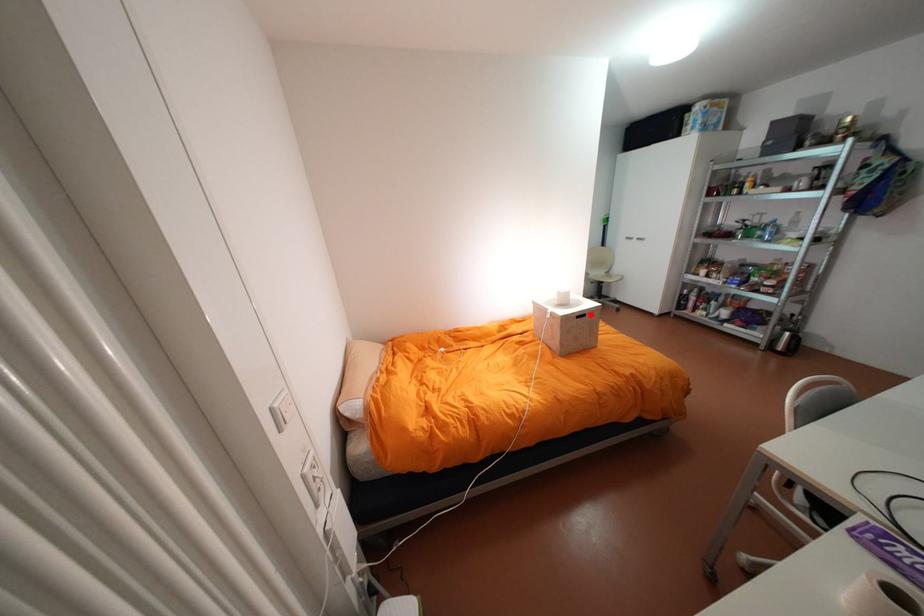
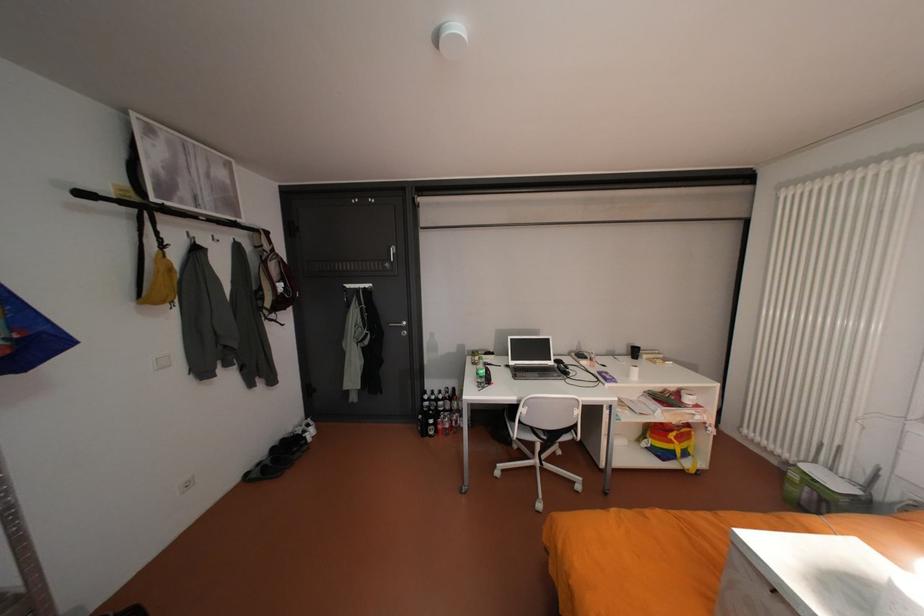
Question: I am providing you with two images of the same scene from different viewpoints. A red point is marked on the first image. Is the red point's position out of view in image 2?

Choices:
 (A) Yes
 (B) No

Answer: (A)